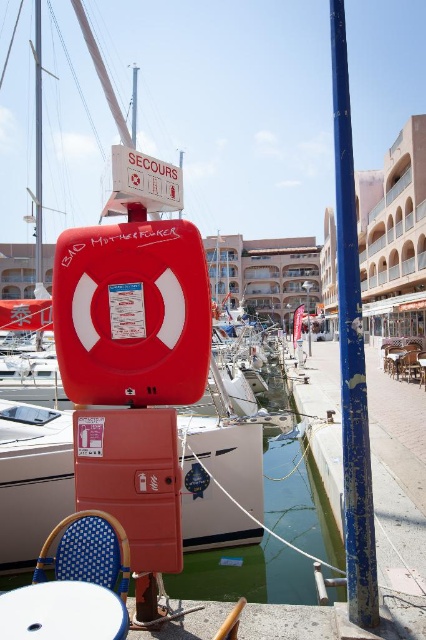
Question: Among these points, which one is farthest from the camera?

Choices:
 (A) (34, 586)
 (B) (400, 364)
 (C) (267, 512)
 (D) (400, 368)

Answer: (D)

Question: Which is nearer to the wooden table at center?

Choices:
 (A) blue peeling paint pole at right
 (B) matte red lifebuoy at center

Answer: (A)

Question: In this image, where is transparent plastic water at lower center located relative to white plastic table at lower left?

Choices:
 (A) below
 (B) above

Answer: (A)

Question: Observing the image, what is the correct spatial positioning of blue peeling paint pole at right in reference to blue woven chair at lower left?

Choices:
 (A) left
 (B) right

Answer: (B)

Question: Which object appears closest to the camera in this image?

Choices:
 (A) blue peeling paint pole at right
 (B) matte red lifebuoy at center
 (C) wooden table at center
 (D) blue woven chair at lower left

Answer: (D)

Question: Does blue woven chair at lower left have a larger size compared to wooden table at center?

Choices:
 (A) yes
 (B) no

Answer: (B)